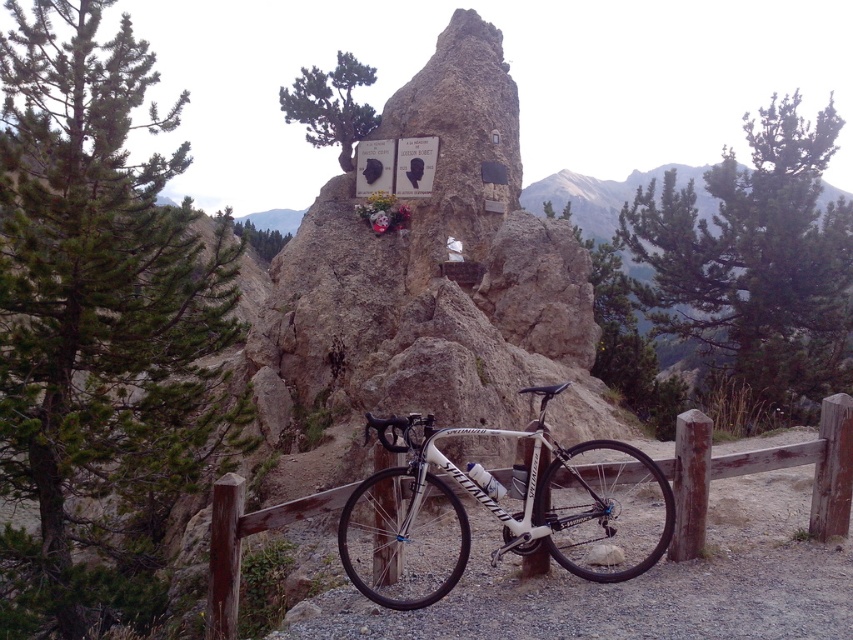
Which is more to the left, green textured pine at upper right or white glossy mountain bike at center?

From the viewer's perspective, white glossy mountain bike at center appears more on the left side.

Is point (850, 259) closer to camera compared to point (654, 541)?

No, it is not.

This screenshot has height=640, width=853. I want to click on green textured pine at upper right, so click(x=755, y=262).

Who is more forward, (x=154, y=259) or (x=846, y=480)?

Point (x=846, y=480) is in front.

What do you see at coordinates (97, 324) in the screenshot?
I see `green needle-like pine at left` at bounding box center [97, 324].

Where is `green needle-like pine at left`? green needle-like pine at left is located at coordinates (97, 324).

Locate an element on the screen. The height and width of the screenshot is (640, 853). green needle-like pine at left is located at coordinates (97, 324).

Is green textured pine at upper right positioned at the back of brown wooden fence at lower center?

Yes.

Which is in front, point (695, 257) or point (840, 420)?

Point (840, 420) is in front.

Where is `green textured pine at upper right`? The height and width of the screenshot is (640, 853). green textured pine at upper right is located at coordinates (755, 262).